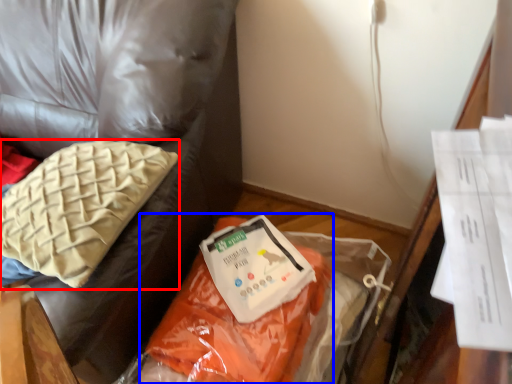
Question: Among these objects, which one is farthest to the camera, pillow (highlighted by a red box) or stuff (highlighted by a blue box)?

Choices:
 (A) pillow
 (B) stuff

Answer: (B)